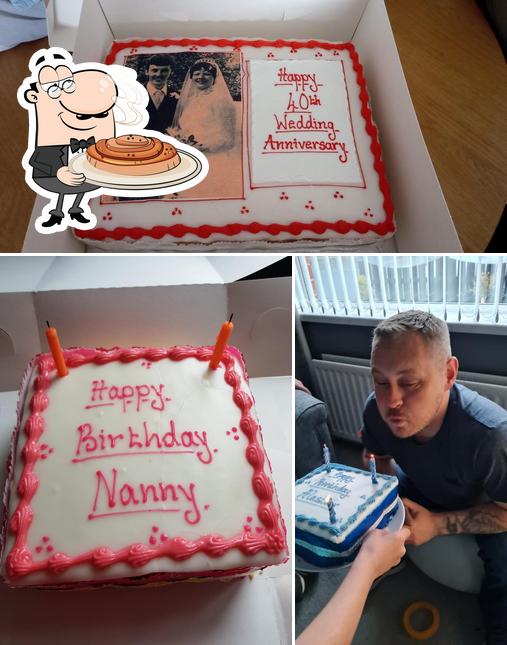
Identify the location of 3 panel picture. The height and width of the screenshot is (645, 507). (305, 284).